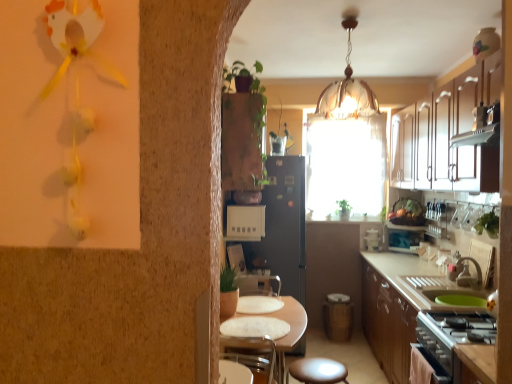
In order to click on blank space situated above translucent glass chandelier at upper center (from a real-world perspective) in this screenshot , I will do `click(353, 21)`.